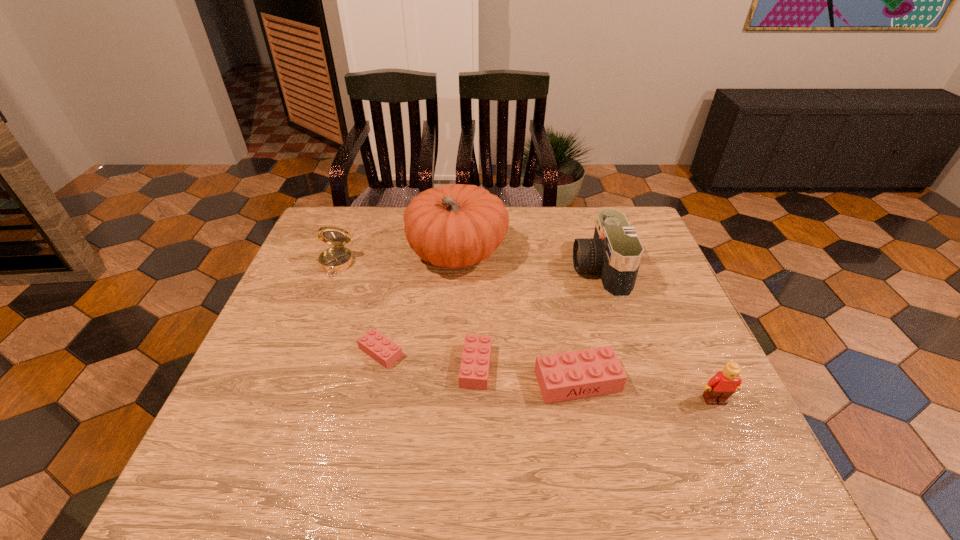
Where is `free point that keeps the Legos evenly spaced on the right`? free point that keeps the Legos evenly spaced on the right is located at coordinates (685, 397).